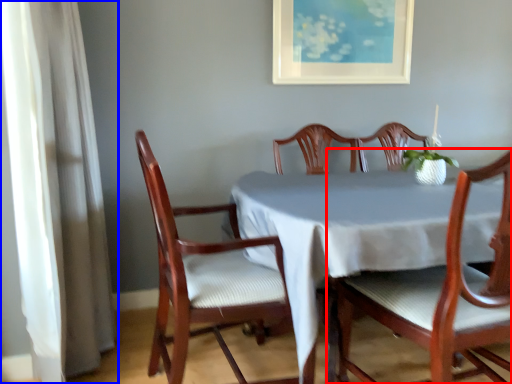
Question: Which of the following is the closest to the observer, chair (highlighted by a red box) or curtain (highlighted by a blue box)?

Choices:
 (A) chair
 (B) curtain

Answer: (A)